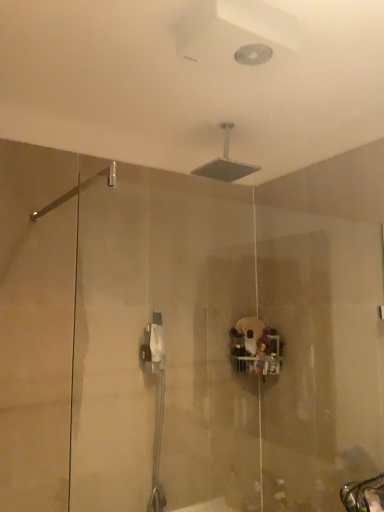
Question: From a real-world perspective, is matte silver showerhead at upper center, acting as the first shower starting from the right, beneath silver metallic grab bar at upper left, the 2th shower viewed from the top?

Choices:
 (A) no
 (B) yes

Answer: (A)

Question: Is matte silver showerhead at upper center, acting as the first shower starting from the right, at the left side of silver metallic grab bar at upper left, which ranks as the first shower in left-to-right order?

Choices:
 (A) yes
 (B) no

Answer: (B)

Question: Is matte silver showerhead at upper center, the 2th shower from the left, positioned far away from silver metallic grab bar at upper left, the 2th shower in the back-to-front sequence?

Choices:
 (A) yes
 (B) no

Answer: (B)

Question: Considering the relative sizes of matte silver showerhead at upper center, the first shower viewed from the top, and silver metallic grab bar at upper left, the 2th shower in the back-to-front sequence, in the image provided, is matte silver showerhead at upper center, the first shower viewed from the top, thinner than silver metallic grab bar at upper left, the 2th shower in the back-to-front sequence,?

Choices:
 (A) no
 (B) yes

Answer: (B)

Question: Does matte silver showerhead at upper center, acting as the second shower starting from the front, have a smaller size compared to silver metallic grab bar at upper left, marked as the 1th shower in a front-to-back arrangement?

Choices:
 (A) no
 (B) yes

Answer: (A)

Question: From the image's perspective, is matte silver showerhead at upper center, the first shower viewed from the top, above silver metallic grab bar at upper left, the 2th shower viewed from the top?

Choices:
 (A) no
 (B) yes

Answer: (B)

Question: Would you say silver metallic grab bar at upper left, the 1th shower ordered from the bottom, is outside matte silver showerhead at upper center, the 2th shower from the left?

Choices:
 (A) no
 (B) yes

Answer: (B)

Question: Are silver metallic grab bar at upper left, the 1th shower ordered from the bottom, and matte silver showerhead at upper center, the 2th shower in the bottom-to-top sequence, far apart?

Choices:
 (A) no
 (B) yes

Answer: (A)

Question: Is silver metallic grab bar at upper left, the 2th shower viewed from the top, facing away from matte silver showerhead at upper center, the 2th shower in the bottom-to-top sequence?

Choices:
 (A) no
 (B) yes

Answer: (A)

Question: Considering the relative positions of silver metallic grab bar at upper left, marked as the 1th shower in a front-to-back arrangement, and matte silver showerhead at upper center, acting as the second shower starting from the front, in the image provided, is silver metallic grab bar at upper left, marked as the 1th shower in a front-to-back arrangement, behind matte silver showerhead at upper center, acting as the second shower starting from the front,?

Choices:
 (A) no
 (B) yes

Answer: (A)

Question: Is silver metallic grab bar at upper left, the 2th shower in the back-to-front sequence, at the left side of matte silver showerhead at upper center, the first shower viewed from the top?

Choices:
 (A) no
 (B) yes

Answer: (B)

Question: From the image's perspective, is silver metallic grab bar at upper left, the 2th shower in the back-to-front sequence, over matte silver showerhead at upper center, the 2th shower in the bottom-to-top sequence?

Choices:
 (A) no
 (B) yes

Answer: (A)

Question: In the image, is matte silver showerhead at upper center, the 2th shower from the left, positioned in front of or behind silver metallic grab bar at upper left, which ranks as the first shower in left-to-right order?

Choices:
 (A) front
 (B) behind

Answer: (B)